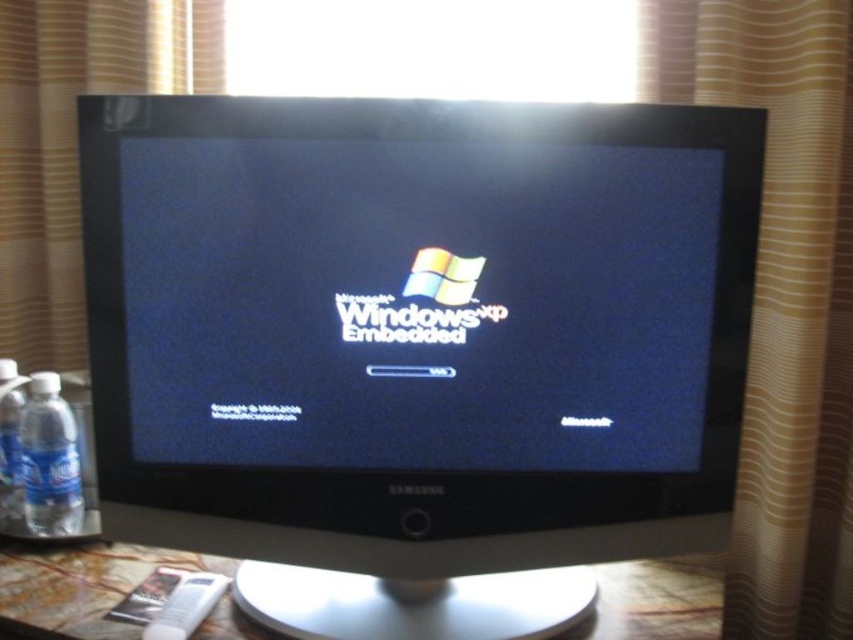
Question: Is satin black monitor at center closer to the viewer compared to clear plastic bottle at lower left?

Choices:
 (A) no
 (B) yes

Answer: (B)

Question: Can you confirm if beige fabric curtain at right is wider than clear plastic water bottle at left?

Choices:
 (A) no
 (B) yes

Answer: (B)

Question: Does marble table at center have a lesser width compared to clear plastic water bottle at left?

Choices:
 (A) yes
 (B) no

Answer: (B)

Question: Which is farther from the satin black monitor at center?

Choices:
 (A) beige fabric curtain at right
 (B) marble table at center
 (C) clear plastic water bottle at left

Answer: (C)

Question: Which point appears farthest from the camera in this image?

Choices:
 (A) (250, 221)
 (B) (10, 449)
 (C) (805, 458)
 (D) (614, 570)

Answer: (B)

Question: Which of the following is the closest to the observer?

Choices:
 (A) (796, 387)
 (B) (165, 563)
 (C) (515, 586)

Answer: (C)